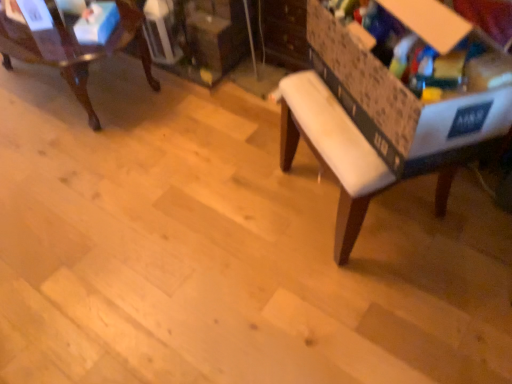
Question: From a real-world perspective, is white fabric bench at center over mahogany wood chair at upper left?

Choices:
 (A) no
 (B) yes

Answer: (B)

Question: From a real-world perspective, is white fabric bench at center under mahogany wood chair at upper left?

Choices:
 (A) no
 (B) yes

Answer: (A)

Question: From the image's perspective, is white fabric bench at center above mahogany wood chair at upper left?

Choices:
 (A) yes
 (B) no

Answer: (B)

Question: Considering the relative sizes of white fabric bench at center and mahogany wood chair at upper left in the image provided, is white fabric bench at center bigger than mahogany wood chair at upper left?

Choices:
 (A) no
 (B) yes

Answer: (B)

Question: Can you confirm if white fabric bench at center is positioned to the right of mahogany wood chair at upper left?

Choices:
 (A) no
 (B) yes

Answer: (B)

Question: Is white fabric bench at center outside mahogany wood chair at upper left?

Choices:
 (A) yes
 (B) no

Answer: (A)

Question: Is mahogany wood chair at upper left in front of blue cardboard box at upper left, which is the 2th storage box in front-to-back order?

Choices:
 (A) yes
 (B) no

Answer: (A)

Question: From a real-world perspective, is mahogany wood chair at upper left positioned over blue cardboard box at upper left, arranged as the 1th storage box when viewed from the left, based on gravity?

Choices:
 (A) yes
 (B) no

Answer: (B)

Question: Does mahogany wood chair at upper left come behind blue cardboard box at upper left, which is counted as the first storage box, starting from the back?

Choices:
 (A) yes
 (B) no

Answer: (B)

Question: From the image's perspective, is mahogany wood chair at upper left below blue cardboard box at upper left, the 2th storage box from the right?

Choices:
 (A) yes
 (B) no

Answer: (B)

Question: Is mahogany wood chair at upper left smaller than blue cardboard box at upper left, the 2th storage box from the right?

Choices:
 (A) yes
 (B) no

Answer: (B)

Question: Is mahogany wood chair at upper left outside blue cardboard box at upper left, which is counted as the first storage box, starting from the back?

Choices:
 (A) yes
 (B) no

Answer: (A)

Question: From the image's perspective, does white fabric bench at center appear higher than cardboard storage box at right, positioned as the 2th storage box in left-to-right order?

Choices:
 (A) no
 (B) yes

Answer: (A)